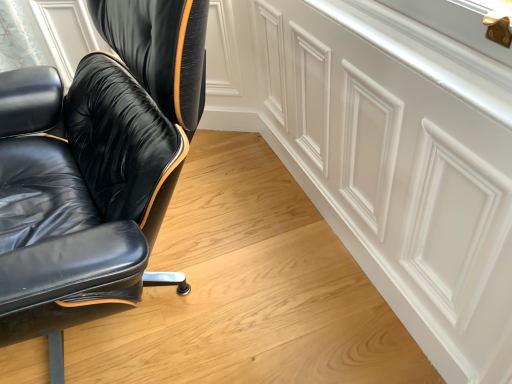
Question: From the image's perspective, relative to black leather chair at left, is white matte cabinetry at upper right above or below?

Choices:
 (A) above
 (B) below

Answer: (B)

Question: In terms of width, does white matte cabinetry at upper right look wider or thinner when compared to black leather chair at left?

Choices:
 (A) thin
 (B) wide

Answer: (A)

Question: Is white matte cabinetry at upper right in front of or behind black leather chair at left in the image?

Choices:
 (A) behind
 (B) front

Answer: (A)

Question: Is black leather chair at left spatially inside white matte cabinetry at upper right, or outside of it?

Choices:
 (A) outside
 (B) inside

Answer: (A)

Question: In the image, is black leather chair at left positioned in front of or behind white matte cabinetry at upper right?

Choices:
 (A) behind
 (B) front

Answer: (B)

Question: From a real-world perspective, is black leather chair at left physically located above or below white matte cabinetry at upper right?

Choices:
 (A) above
 (B) below

Answer: (A)

Question: Is black leather chair at left bigger or smaller than white matte cabinetry at upper right?

Choices:
 (A) small
 (B) big

Answer: (B)